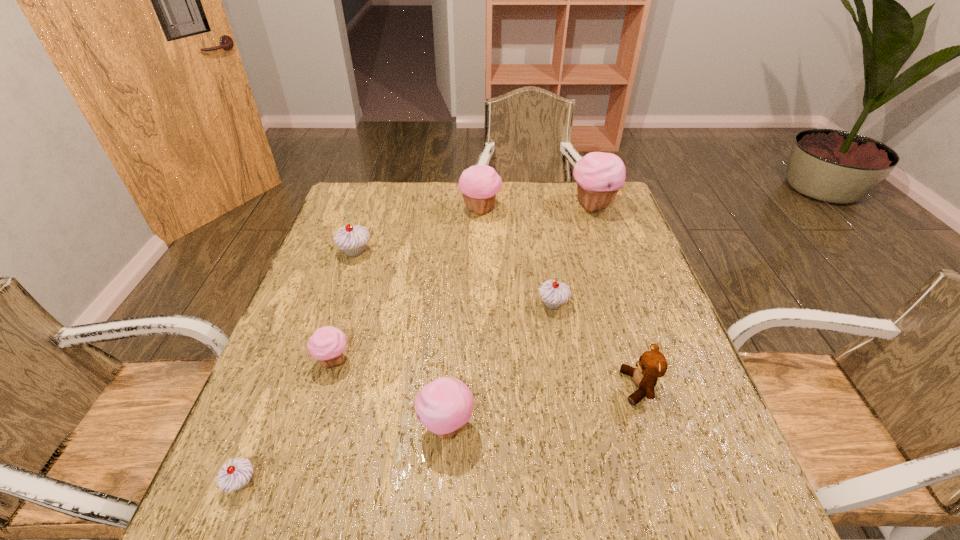
Identify the location of vacant space located on the front-facing side of the teddy bear. (522, 387).

This screenshot has width=960, height=540. What are the coordinates of `free point located on the front-facing side of the teddy bear` in the screenshot? It's located at (469, 387).

Where is `vacant area located 0.080m on the back of the third farthest pink cupcake`? The height and width of the screenshot is (540, 960). vacant area located 0.080m on the back of the third farthest pink cupcake is located at coordinates (346, 321).

Find the location of `vacant area situated on the right of the nearest gray cupcake`. vacant area situated on the right of the nearest gray cupcake is located at coordinates (485, 483).

Where is `object present at the near edge`? object present at the near edge is located at coordinates (235, 475).

Find the location of `cupcake positioned at the right edge`. cupcake positioned at the right edge is located at coordinates (599, 176).

You are a GUI agent. You are given a task and a screenshot of the screen. Output one action in this format:
    pyautogui.click(x=<x>, y=<y>)
    Task: Click on the teddy bear that is at the right edge
    The image size is (960, 540).
    Given the screenshot: What is the action you would take?
    pyautogui.click(x=652, y=365)

Where is `object that is at the near left corner`? object that is at the near left corner is located at coordinates tap(235, 475).

This screenshot has width=960, height=540. Find the location of `object that is at the far right corner`. object that is at the far right corner is located at coordinates (599, 176).

Find the location of `vacant space at the far edge of the desktop`. vacant space at the far edge of the desktop is located at coordinates (540, 205).